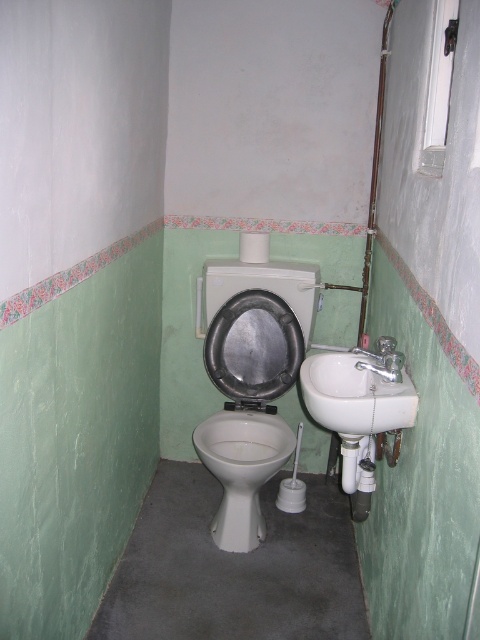
Question: Does white glossy toilet at center have a smaller size compared to white glossy toilet bowl at center?

Choices:
 (A) yes
 (B) no

Answer: (B)

Question: Which point is farther from the camera taking this photo?

Choices:
 (A) (244, 392)
 (B) (375, 360)

Answer: (A)

Question: Which point appears closest to the camera in this image?

Choices:
 (A) (240, 448)
 (B) (226, 362)

Answer: (A)

Question: Among these objects, which one is farthest from the camera?

Choices:
 (A) white glossy toilet at center
 (B) white glossy toilet bowl at center

Answer: (A)

Question: Is the position of white glossy toilet at center less distant than that of metallic silver toilet lid at center?

Choices:
 (A) yes
 (B) no

Answer: (A)

Question: Does white glossy toilet at center appear under metallic silver toilet lid at center?

Choices:
 (A) yes
 (B) no

Answer: (A)